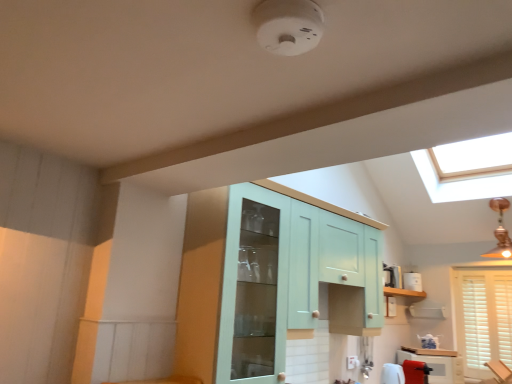
Question: Considering the relative sizes of white glossy counter top at lower right and light teal glass cabinet at center, arranged as the second cabinetry when ordered from the bottom, in the image provided, is white glossy counter top at lower right shorter than light teal glass cabinet at center, arranged as the second cabinetry when ordered from the bottom,?

Choices:
 (A) yes
 (B) no

Answer: (A)

Question: Is the depth of white glossy counter top at lower right greater than that of light teal glass cabinet at center, arranged as the second cabinetry when ordered from the bottom?

Choices:
 (A) yes
 (B) no

Answer: (A)

Question: Is white glossy counter top at lower right closer to the viewer compared to light teal glass cabinet at center, which is the first cabinetry from left to right?

Choices:
 (A) yes
 (B) no

Answer: (B)

Question: Considering the relative sizes of white glossy counter top at lower right and light teal glass cabinet at center, marked as the first cabinetry in a front-to-back arrangement, in the image provided, is white glossy counter top at lower right wider than light teal glass cabinet at center, marked as the first cabinetry in a front-to-back arrangement,?

Choices:
 (A) no
 (B) yes

Answer: (A)

Question: Considering the relative sizes of white glossy counter top at lower right and light teal glass cabinet at center, marked as the second cabinetry in a back-to-front arrangement, in the image provided, is white glossy counter top at lower right bigger than light teal glass cabinet at center, marked as the second cabinetry in a back-to-front arrangement,?

Choices:
 (A) no
 (B) yes

Answer: (A)

Question: Is white glossy counter top at lower right looking in the opposite direction of light teal glass cabinet at center, which appears as the second cabinetry when viewed from the right?

Choices:
 (A) yes
 (B) no

Answer: (B)

Question: From a real-world perspective, does white plastic toaster at right stand above white glossy counter top at lower right?

Choices:
 (A) yes
 (B) no

Answer: (A)

Question: Is white plastic toaster at right behind white glossy counter top at lower right?

Choices:
 (A) yes
 (B) no

Answer: (A)

Question: From a real-world perspective, is white plastic toaster at right under white glossy counter top at lower right?

Choices:
 (A) yes
 (B) no

Answer: (B)

Question: Considering the relative sizes of white plastic toaster at right and white glossy counter top at lower right in the image provided, is white plastic toaster at right smaller than white glossy counter top at lower right?

Choices:
 (A) no
 (B) yes

Answer: (B)

Question: Does white plastic toaster at right come in front of white glossy counter top at lower right?

Choices:
 (A) no
 (B) yes

Answer: (A)

Question: Does white plastic toaster at right have a lesser height compared to white glossy counter top at lower right?

Choices:
 (A) yes
 (B) no

Answer: (B)

Question: Is the depth of white wooden blinds at lower right less than that of matte white cabinet at lower right, the 1th cabinetry viewed from the back?

Choices:
 (A) no
 (B) yes

Answer: (A)